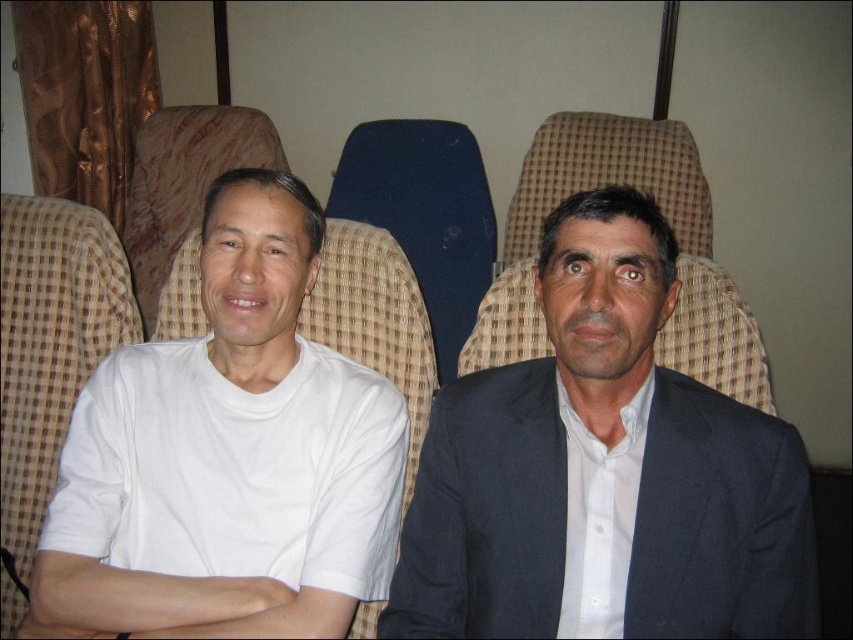
Question: Which is farther from the blue fabric chair at center?

Choices:
 (A) white cotton t-shirt at center
 (B) woven fabric chair at center
 (C) dark blue suit at center
 (D) beige fabric chair at left

Answer: (C)

Question: Based on their relative distances, which object is farther from the beige fabric chair at left?

Choices:
 (A) white fabric chair at left
 (B) white cotton t-shirt at center
 (C) dark blue suit at center
 (D) blue fabric chair at center

Answer: (C)

Question: Is dark blue suit at center below white cotton t-shirt at center?

Choices:
 (A) no
 (B) yes

Answer: (B)

Question: Which point is closer to the camera taking this photo?

Choices:
 (A) (426, 612)
 (B) (257, 141)
 (C) (531, 212)

Answer: (A)

Question: Is dark blue suit at center closer to the viewer compared to white cotton t-shirt at center?

Choices:
 (A) yes
 (B) no

Answer: (A)

Question: Is woven fabric chair at center to the left of blue fabric chair at center from the viewer's perspective?

Choices:
 (A) yes
 (B) no

Answer: (B)